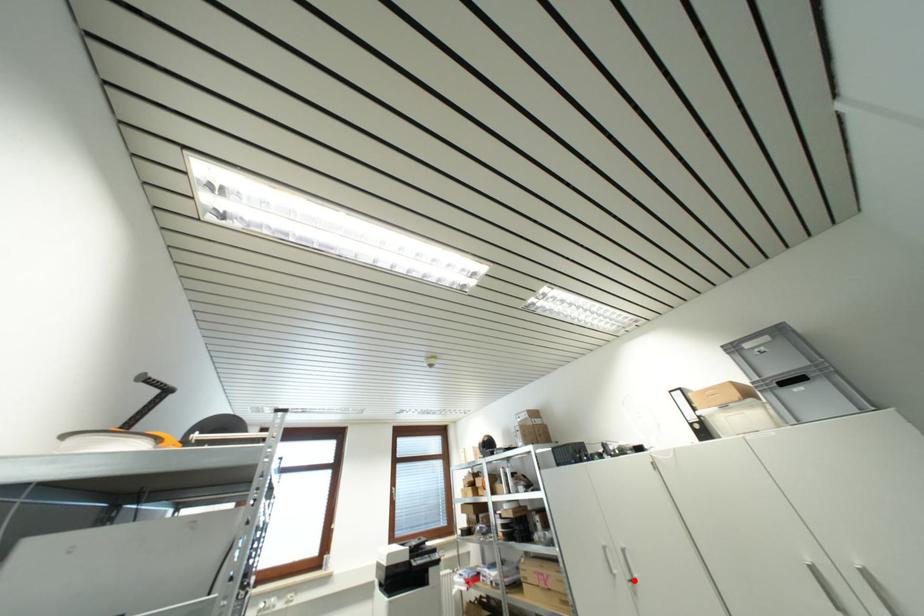
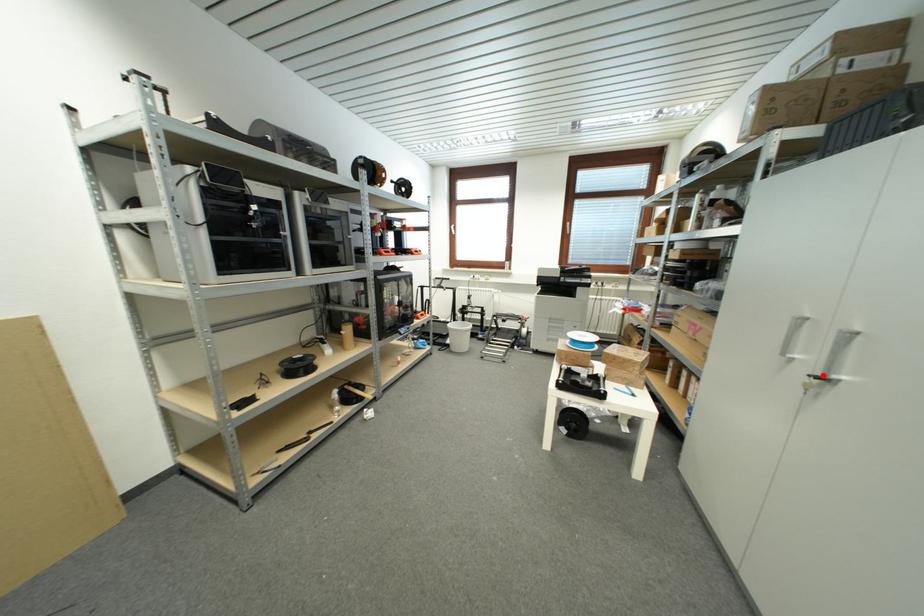
I am providing you with two images of the same scene from different viewpoints. A red point is marked on the first image and another point is marked on the second image. Is the marked point in image1 the same physical position as the marked point in image2?

Yes